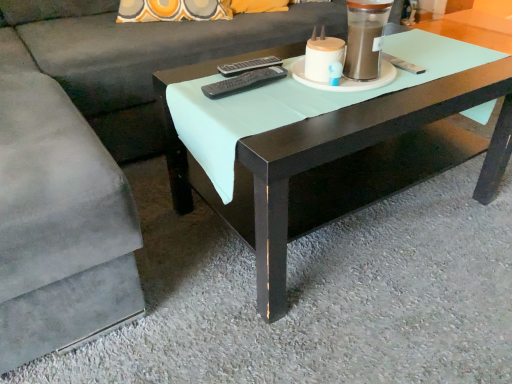
I want to click on vacant space situated on the left part of matte white candle holder at upper center, so (x=285, y=92).